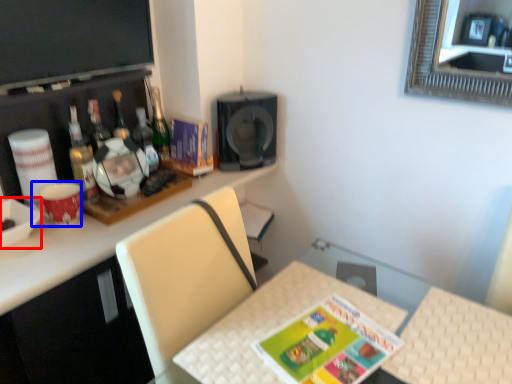
Question: Among these objects, which one is farthest to the camera, bowl (highlighted by a red box) or coffee cup (highlighted by a blue box)?

Choices:
 (A) bowl
 (B) coffee cup

Answer: (B)